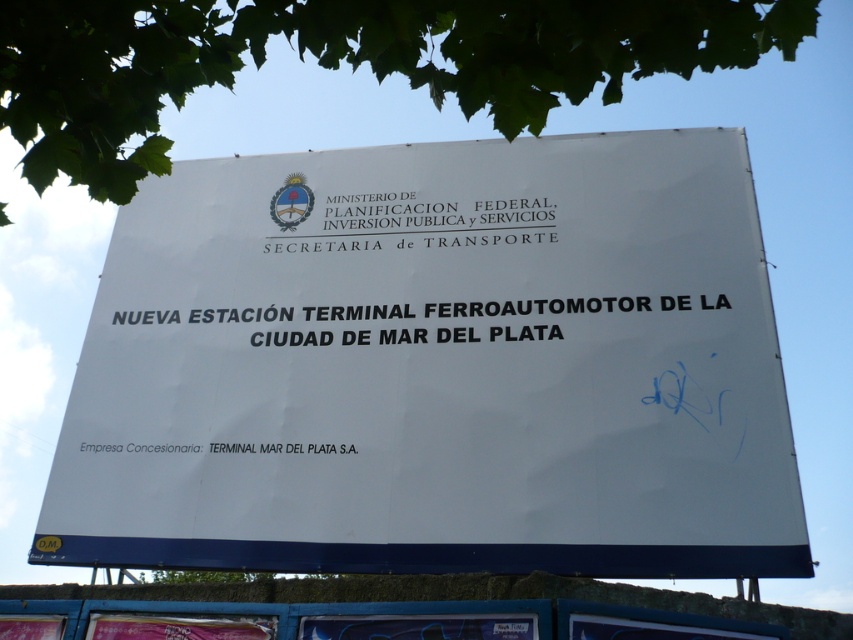
Consider the image. Based on the scene description, can you determine the spatial relationship between the white paper sign at center and the black text at center?

The white paper sign at center is below the black text at center.

Based on the scene description, which object is positioned lower between the black text at center and the white paper at upper center?

The black text at center is positioned lower than the white paper at upper center.